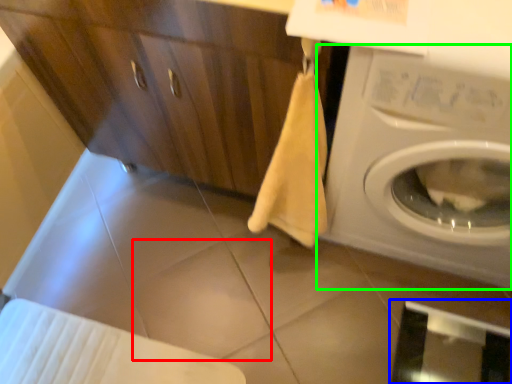
Question: Which object is the farthest from tile (highlighted by a red box)? Choose among these: screen door (highlighted by a blue box) or washing machine (highlighted by a green box).

Choices:
 (A) screen door
 (B) washing machine

Answer: (A)